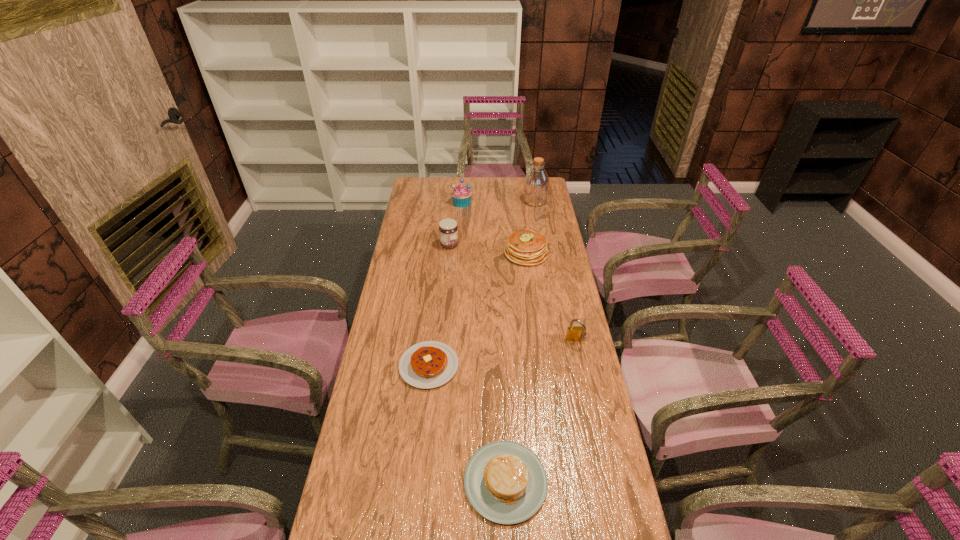
The width and height of the screenshot is (960, 540). Identify the location of pancake that can be found as the second closest to the nearest object. (525, 247).

The width and height of the screenshot is (960, 540). In order to click on vacant space that satisfies the following two spatial constraints: 1. on the back side of the bottle; 2. on the right side of the muffin in this screenshot , I will do `click(462, 201)`.

Where is `free location that satisfies the following two spatial constraints: 1. on the front side of the muffin; 2. on the left side of the farthest pancake`? This screenshot has width=960, height=540. free location that satisfies the following two spatial constraints: 1. on the front side of the muffin; 2. on the left side of the farthest pancake is located at coordinates (459, 253).

The height and width of the screenshot is (540, 960). In order to click on free space that satisfies the following two spatial constraints: 1. on the back side of the tallest pancake; 2. on the right side of the tallest object in this screenshot , I will do `click(519, 201)`.